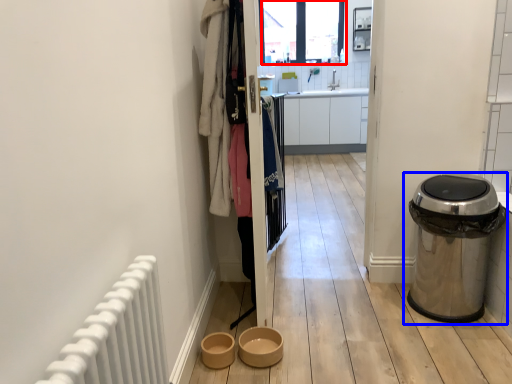
Question: Which point is closer to the camera, window screen (highlighted by a red box) or waste container (highlighted by a blue box)?

Choices:
 (A) window screen
 (B) waste container

Answer: (B)